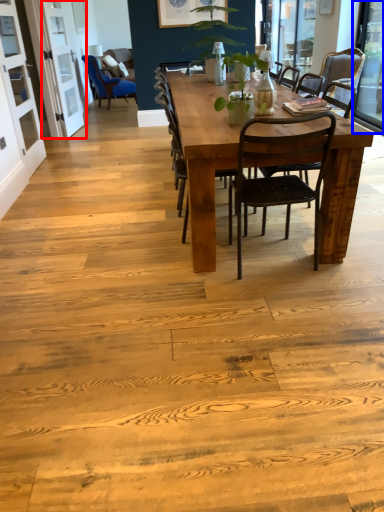
Question: Which object appears farthest to the camera in this image, screen door (highlighted by a red box) or window screen (highlighted by a blue box)?

Choices:
 (A) screen door
 (B) window screen

Answer: (A)